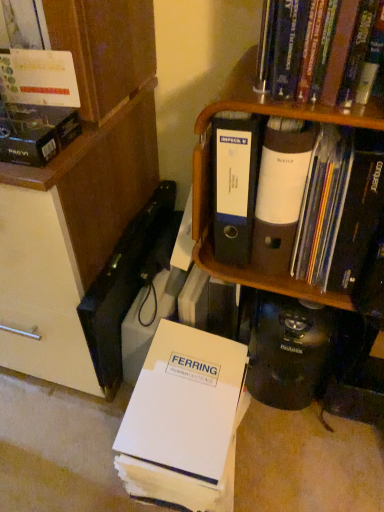
Question: Is hardcover book at upper right, which is counted as the 1th book, starting from the top, turned away from matte cardboard box at upper left, placed as the second book when sorted from top to bottom?

Choices:
 (A) yes
 (B) no

Answer: (B)

Question: From the image's perspective, is hardcover book at upper right, which is counted as the 1th book, starting from the top, on top of matte cardboard box at upper left, which is counted as the third book, starting from the bottom?

Choices:
 (A) no
 (B) yes

Answer: (B)

Question: Is hardcover book at upper right, which is counted as the 1th book, starting from the top, closer to the viewer compared to matte cardboard box at upper left, placed as the second book when sorted from top to bottom?

Choices:
 (A) yes
 (B) no

Answer: (A)

Question: Can you confirm if hardcover book at upper right, which is counted as the 1th book, starting from the top, is positioned to the left of matte cardboard box at upper left, which is counted as the third book, starting from the bottom?

Choices:
 (A) no
 (B) yes

Answer: (A)

Question: Is hardcover book at upper right, the 4th book positioned from the bottom, placed right next to matte cardboard box at upper left, which is counted as the third book, starting from the bottom?

Choices:
 (A) no
 (B) yes

Answer: (A)

Question: From the image's perspective, is hardcover book at upper right, which is counted as the 1th book, starting from the top, positioned above or below white paper folder at lower center, positioned as the first book in bottom-to-top order?

Choices:
 (A) below
 (B) above

Answer: (B)

Question: Is hardcover book at upper right, the 4th book positioned from the bottom, bigger or smaller than white paper folder at lower center, positioned as the first book in bottom-to-top order?

Choices:
 (A) big
 (B) small

Answer: (B)

Question: From a real-world perspective, is hardcover book at upper right, which is counted as the 1th book, starting from the top, above or below white paper folder at lower center, placed as the 4th book when sorted from top to bottom?

Choices:
 (A) below
 (B) above

Answer: (B)

Question: Is hardcover book at upper right, which is counted as the 1th book, starting from the top, in front of or behind white paper folder at lower center, positioned as the first book in bottom-to-top order, in the image?

Choices:
 (A) front
 (B) behind

Answer: (A)

Question: Which is correct: hardcover book at upper right, the 4th book positioned from the bottom, is inside matte black folder at upper right, the second book positioned from the bottom, or outside of it?

Choices:
 (A) inside
 (B) outside

Answer: (B)

Question: From a real-world perspective, is hardcover book at upper right, which is counted as the 1th book, starting from the top, positioned above or below matte black folder at upper right, the third book positioned from the top?

Choices:
 (A) below
 (B) above

Answer: (B)

Question: Considering the positions of point (372, 11) and point (372, 144), is point (372, 11) closer or farther from the camera than point (372, 144)?

Choices:
 (A) farther
 (B) closer

Answer: (B)

Question: Is hardcover book at upper right, which is counted as the 1th book, starting from the top, bigger or smaller than matte black folder at upper right, the second book positioned from the bottom?

Choices:
 (A) small
 (B) big

Answer: (A)

Question: From the image's perspective, is matte black folder at upper right, the third book positioned from the top, located above or below brown cardboard shelf at upper right?

Choices:
 (A) below
 (B) above

Answer: (B)

Question: Considering the positions of matte black folder at upper right, the third book positioned from the top, and brown cardboard shelf at upper right in the image, is matte black folder at upper right, the third book positioned from the top, bigger or smaller than brown cardboard shelf at upper right?

Choices:
 (A) small
 (B) big

Answer: (A)